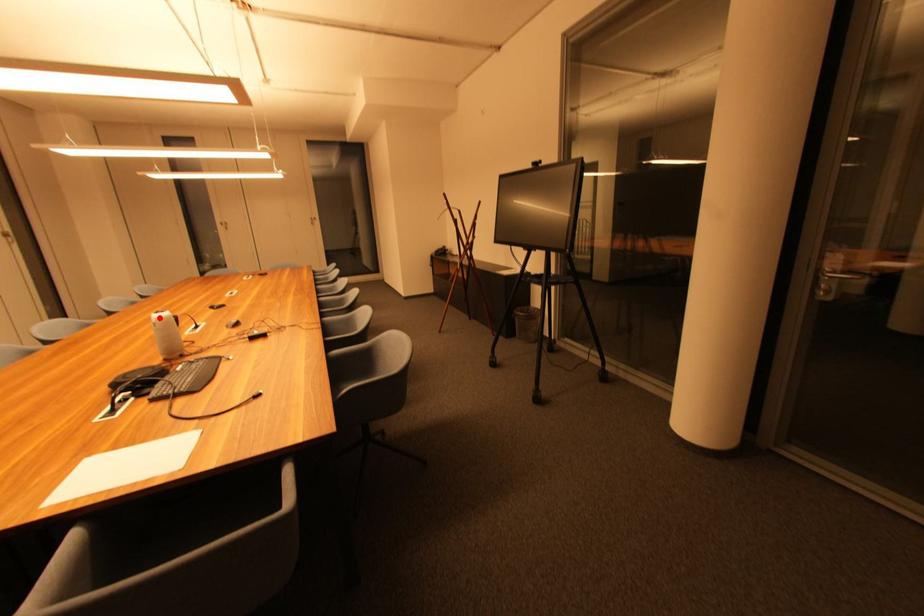
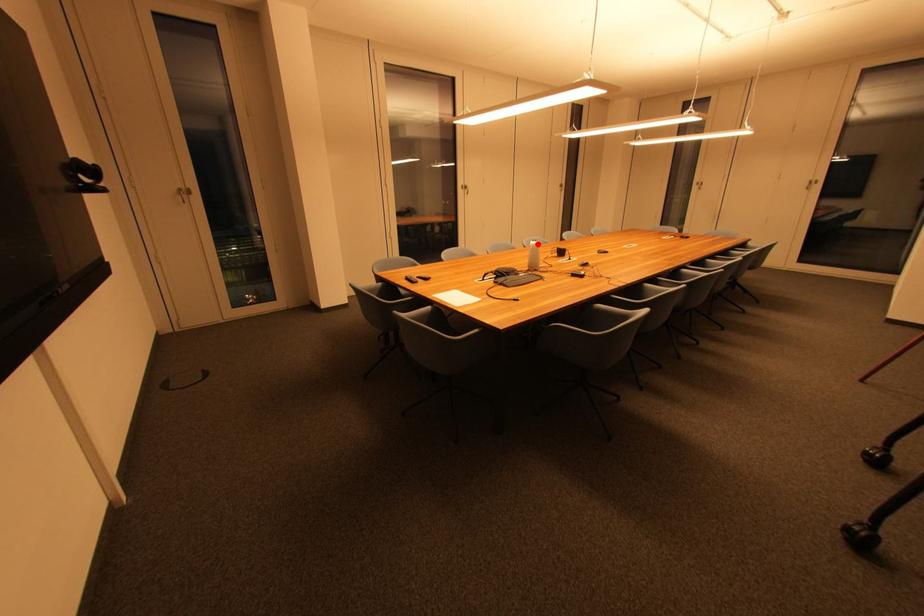
I am providing you with two images of the same scene from different viewpoints. A red point is marked on the first image and another point is marked on the second image. Is the red point in image1 aligned with the point shown in image2?

Yes